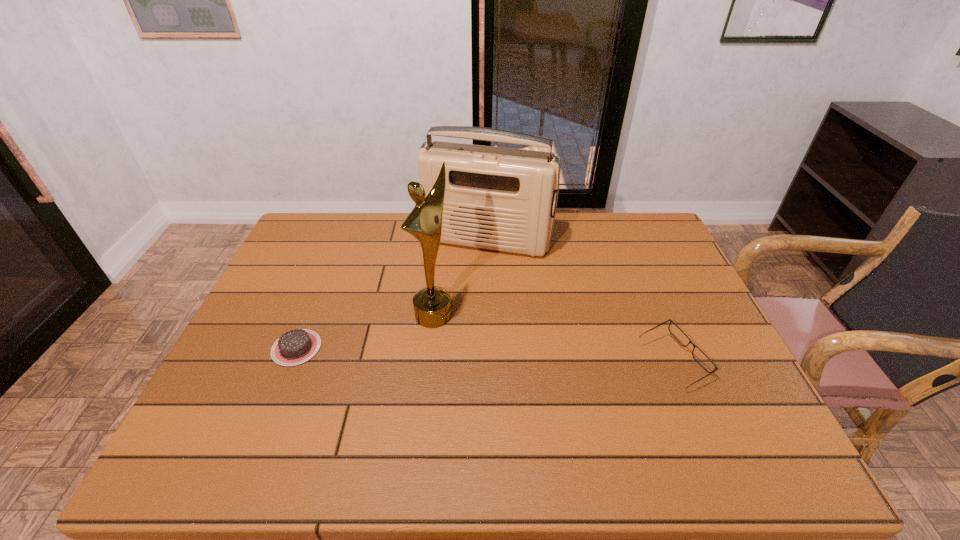
Identify the location of vacant space situated 0.330m on the front-facing side of the award. The image size is (960, 540). (556, 389).

The image size is (960, 540). I want to click on vacant region located 0.210m on the front-facing side of the farthest object, so click(456, 306).

You are a GUI agent. You are given a task and a screenshot of the screen. Output one action in this format:
    pyautogui.click(x=<x>, y=<y>)
    Task: Click on the free spot located 0.110m on the front-facing side of the farthest object
    This screenshot has width=960, height=540.
    Given the screenshot: What is the action you would take?
    pyautogui.click(x=465, y=282)

The height and width of the screenshot is (540, 960). I want to click on free space located 0.210m on the front-facing side of the farthest object, so pos(456,306).

You are a GUI agent. You are given a task and a screenshot of the screen. Output one action in this format:
    pyautogui.click(x=<x>, y=<y>)
    Task: Click on the object that is at the far edge
    Image resolution: width=960 pixels, height=540 pixels.
    Given the screenshot: What is the action you would take?
    pyautogui.click(x=496, y=198)

Find the location of a particular element. object located in the near edge section of the desktop is located at coordinates (704, 361).

Image resolution: width=960 pixels, height=540 pixels. What are the coordinates of `object situated at the left edge` in the screenshot? It's located at tap(294, 347).

Identify the location of object located in the right edge section of the desktop. (704, 361).

Where is `object located at the near right corner`? This screenshot has width=960, height=540. object located at the near right corner is located at coordinates (704, 361).

In the image, there is a desktop. Identify the location of free space at the far edge. (367, 218).